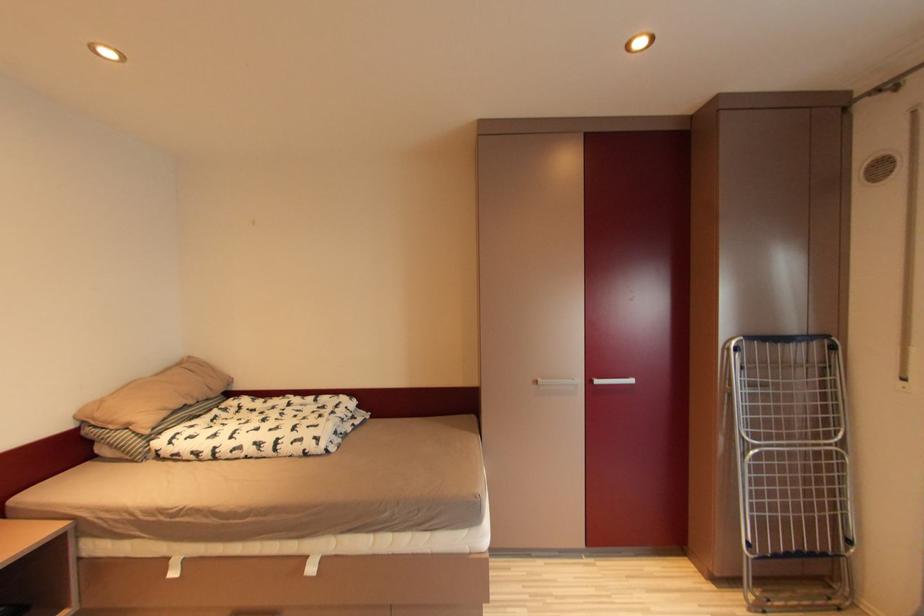
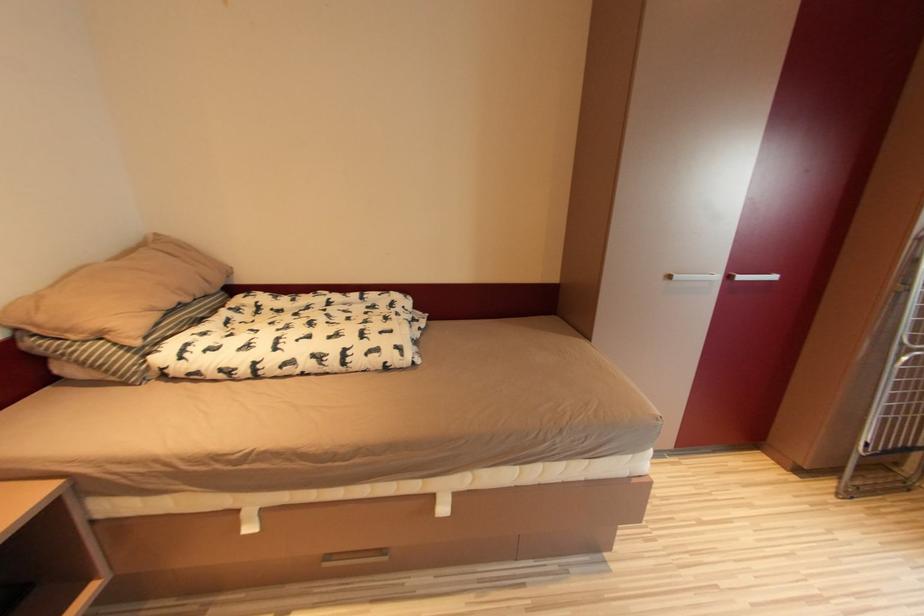
Question: The first image is from the beginning of the video and the second image is from the end. How did the camera likely rotate when shooting the video?

Choices:
 (A) Left
 (B) Right
 (C) Up
 (D) Down

Answer: (D)